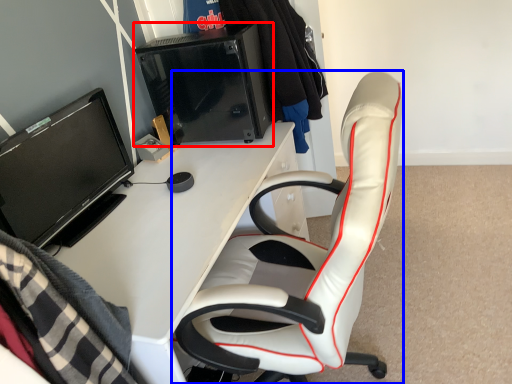
Question: Among these objects, which one is nearest to the camera, desktop computer (highlighted by a red box) or chair (highlighted by a blue box)?

Choices:
 (A) desktop computer
 (B) chair

Answer: (B)